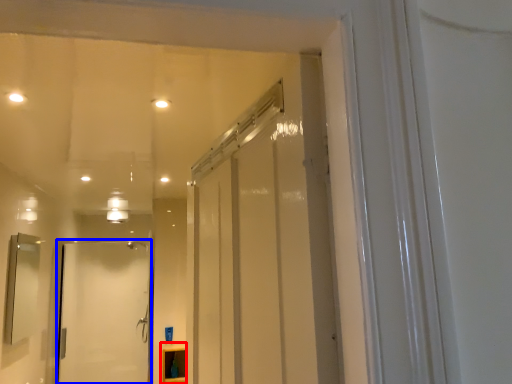
Question: Which object appears farthest to the camera in this image, cabinetry (highlighted by a red box) or door (highlighted by a blue box)?

Choices:
 (A) cabinetry
 (B) door

Answer: (B)